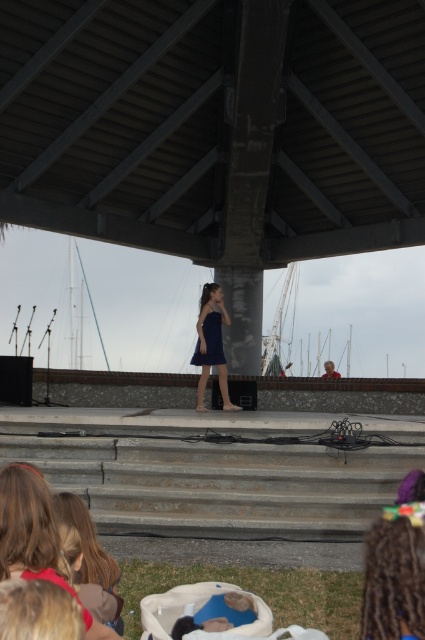
Measure the distance between navy satin dress at center and satin blue dress at center.

navy satin dress at center and satin blue dress at center are 10.02 centimeters apart from each other.

Which is behind, point (212, 348) or point (209, 342)?

Positioned behind is point (209, 342).

You are a GUI agent. You are given a task and a screenshot of the screen. Output one action in this format:
    pyautogui.click(x=<x>, y=<y>)
    Task: Click on the navy satin dress at center
    The image size is (425, 640).
    Given the screenshot: What is the action you would take?
    pyautogui.click(x=212, y=342)